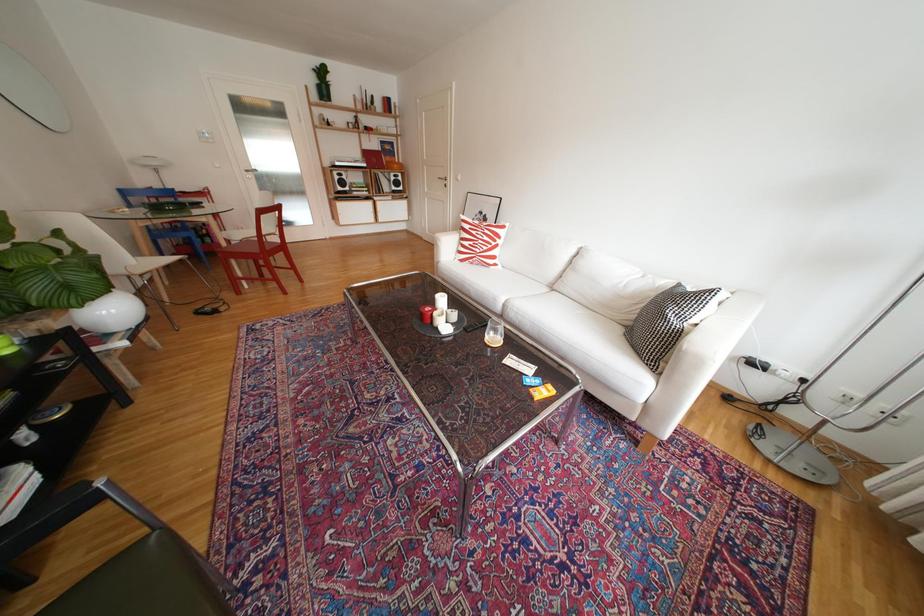
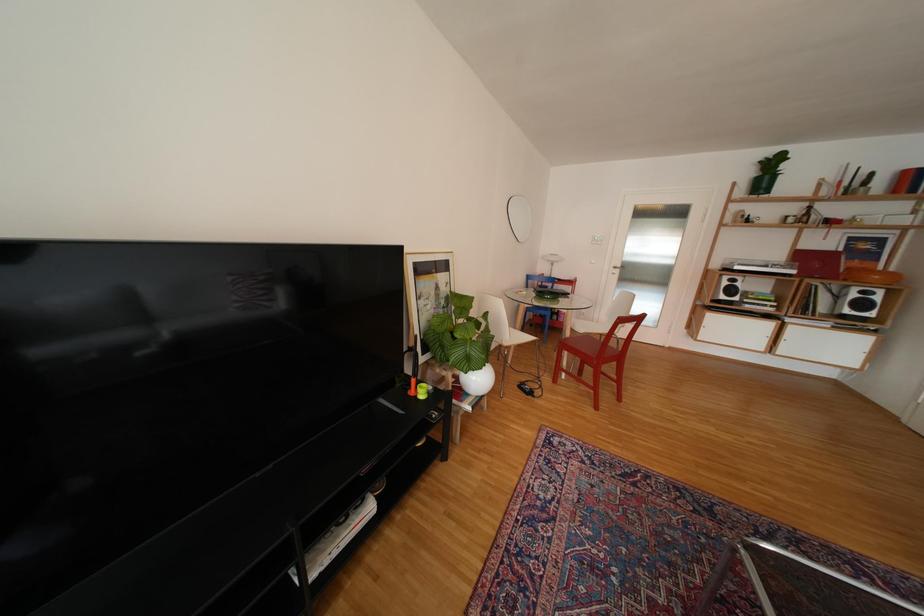
Question: The camera is either moving clockwise (left) or counter-clockwise (right) around the object. The first image is from the beginning of the video and the second image is from the end. Is the camera moving left or right when shooting the video?

Choices:
 (A) Left
 (B) Right

Answer: (B)